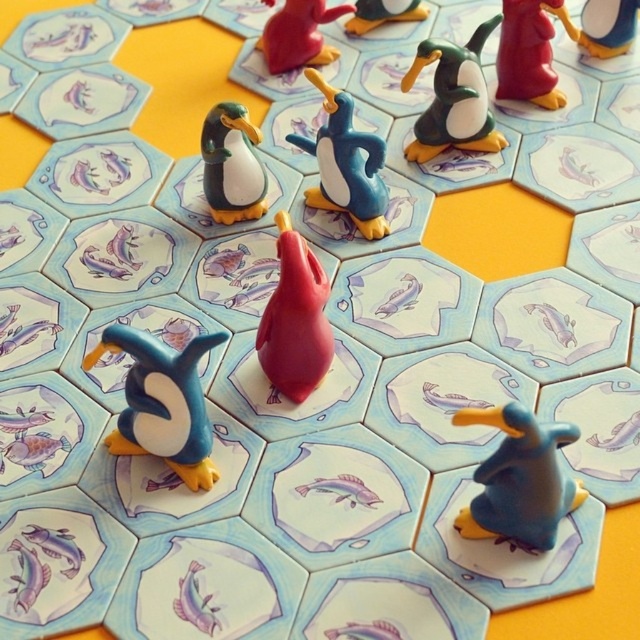
You are playing a board game and need to place a new penguin on the board. The new penguin must be placed next to the shiny plastic penguin at upper right but not overlapping with the matte blue penguin at upper center. Which penguin should you consider the size of when choosing where to place the new penguin?

You should consider the size of the shiny plastic penguin at upper right because it is larger than the matte blue penguin at upper center, so placing the new penguin next to it requires more space to avoid overlapping.

You are playing a board game and want to place a new penguin exactly where the shiny plastic penguin at upper right is located. What are the coordinates where you should place your penguin?

The coordinates for the shiny plastic penguin at upper right are at point (602, 26). You should place your penguin there.